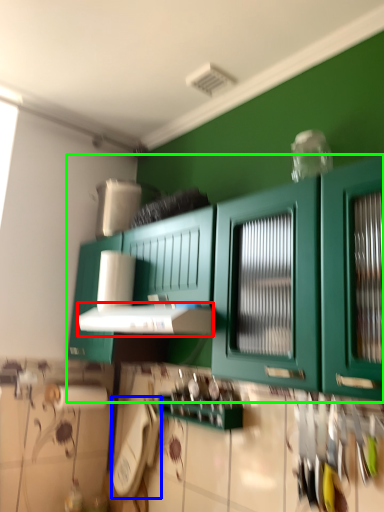
Question: Which is nearer to the vent (highlighted by a red box)? appliance (highlighted by a blue box) or cabinetry (highlighted by a green box).

Choices:
 (A) appliance
 (B) cabinetry

Answer: (B)